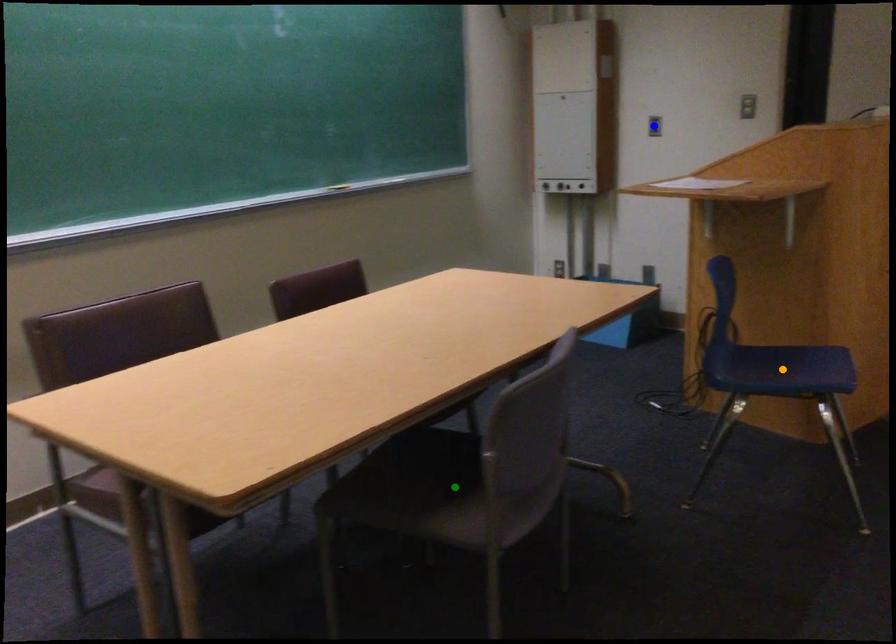
Order these from nearest to farthest:
- green point
- blue point
- orange point

green point
orange point
blue point